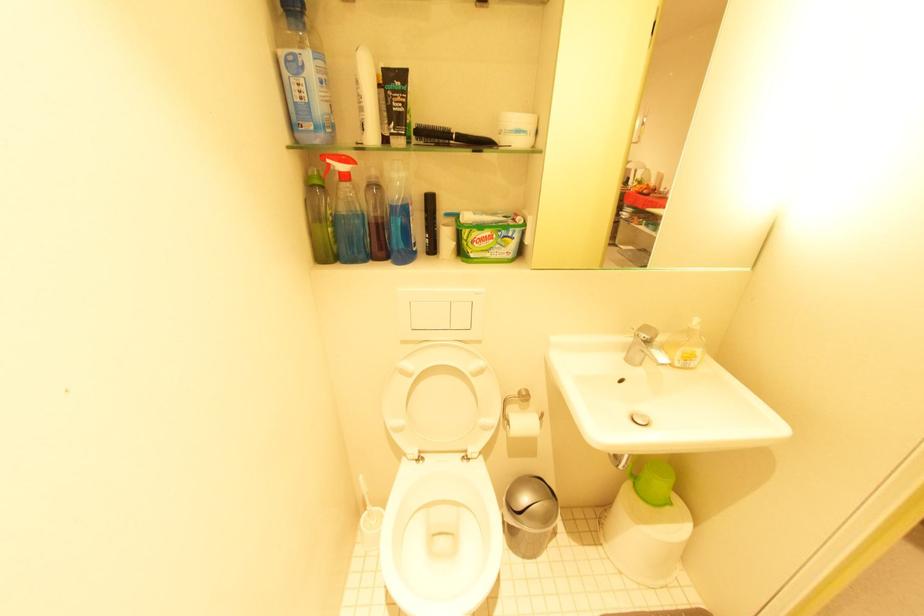
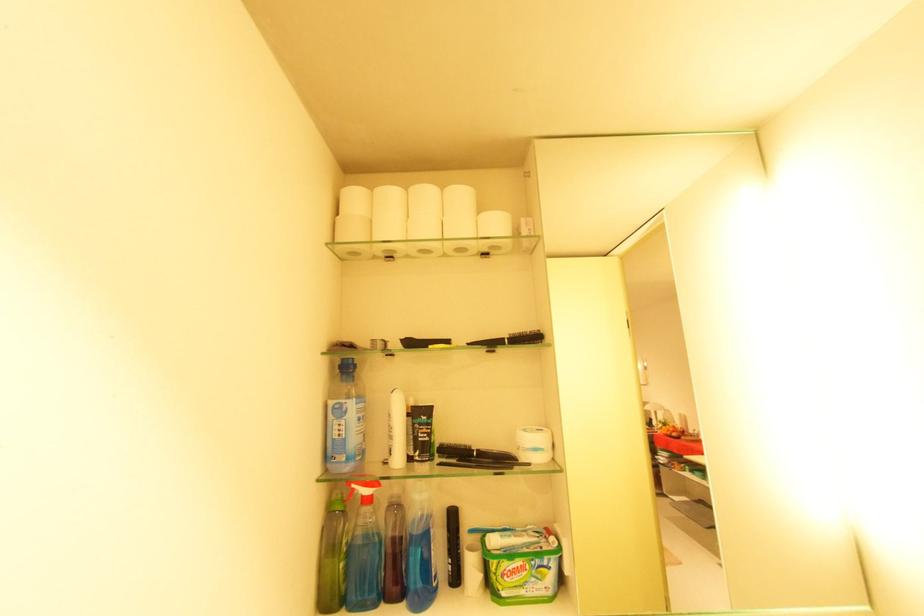
In the second image, find the point that corresponds to point (464, 134) in the first image.

(484, 451)